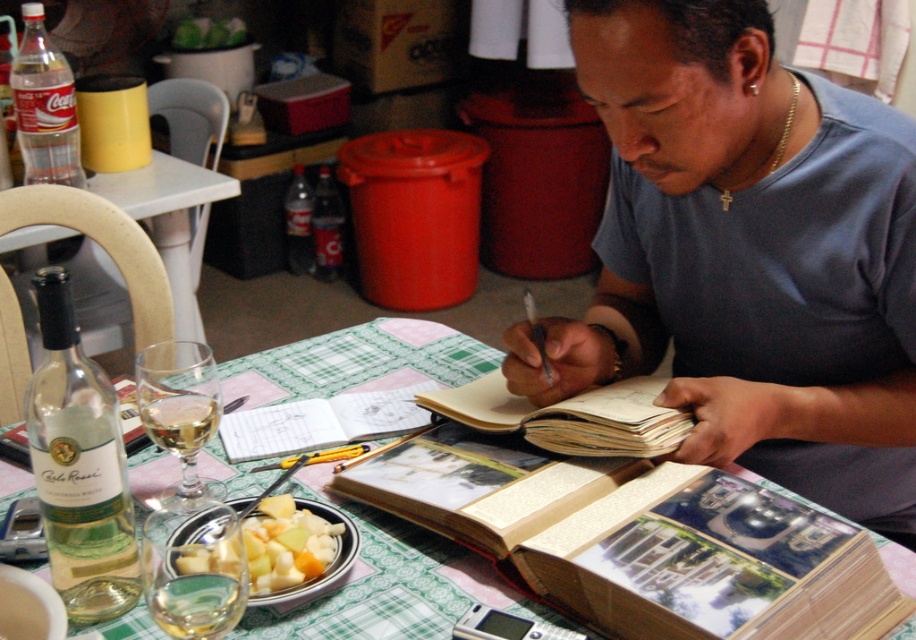
Consider the image. You are standing at the table where the man is writing. There are two points marked on the table. One is at coordinate point (72,588) and the other is at point (195,456). Which point is closer to you?

Point (72,588) is in front of point (195,456), so it is closer to you.

You are a guest at this table. You want to reach for the clear glass wine at center without moving the clear glass wine glass at table left. Is it possible?

The clear glass wine glass at table left is located below the clear glass wine at center, so you can reach the clear glass wine at center without moving the glass below it.

You are a guest at this table. You want to reach for the clear glass wine at center without moving the clear glass wine glass at table left. Is this possible?

The clear glass wine glass at table left is in front of the clear glass wine at center, so you cannot reach the clear glass wine at center without moving the clear glass wine glass at table left.